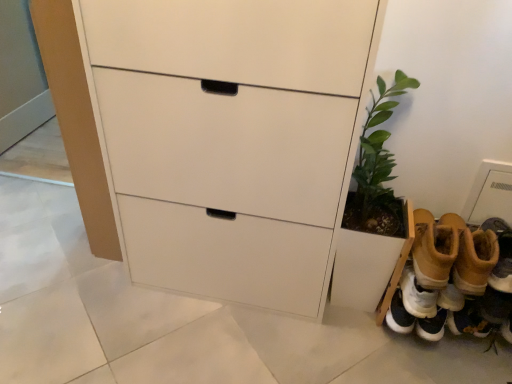
Image resolution: width=512 pixels, height=384 pixels. What do you see at coordinates (452, 282) in the screenshot?
I see `tan suede boots at lower right, positioned as the first footwear in right-to-left order` at bounding box center [452, 282].

Locate an element on the screen. Image resolution: width=512 pixels, height=384 pixels. white matte chest of drawers at center is located at coordinates (229, 138).

What do you see at coordinates (372, 213) in the screenshot? I see `green leafy plant at lower right` at bounding box center [372, 213].

Identify the location of tan suede boots at lower right, positioned as the first footwear in right-to-left order. The image size is (512, 384). (452, 282).

Is tan suede boots at lower right, positioned as the first footwear in right-to-left order, to the left of green leafy plant at lower right from the viewer's perspective?

No, tan suede boots at lower right, positioned as the first footwear in right-to-left order, is not to the left of green leafy plant at lower right.

Considering the sizes of objects tan suede boots at lower right, placed as the second footwear when sorted from left to right, and green leafy plant at lower right in the image provided, who is taller, tan suede boots at lower right, placed as the second footwear when sorted from left to right, or green leafy plant at lower right?

Standing taller between the two is green leafy plant at lower right.

How different are the orientations of tan suede boots at lower right, positioned as the first footwear in right-to-left order, and green leafy plant at lower right in degrees?

2.03 degrees separate the facing orientations of tan suede boots at lower right, positioned as the first footwear in right-to-left order, and green leafy plant at lower right.

Is tan suede boots at lower right, placed as the second footwear when sorted from left to right, directly adjacent to green leafy plant at lower right?

No, tan suede boots at lower right, placed as the second footwear when sorted from left to right, is not making contact with green leafy plant at lower right.

Between green leafy plant at lower right and white matte chest of drawers at center, which one is positioned in front?

white matte chest of drawers at center.

From a real-world perspective, is green leafy plant at lower right on white matte chest of drawers at center?

Incorrect, from a real-world perspective, green leafy plant at lower right is lower than white matte chest of drawers at center.

Is green leafy plant at lower right to the left or to the right of white matte chest of drawers at center in the image?

green leafy plant at lower right is positioned on white matte chest of drawers at center's right side.

From the image's perspective, between green leafy plant at lower right and white matte chest of drawers at center, which one is located above?

white matte chest of drawers at center.

Is tan suede boots at lower right, which appears as the 2th footwear when viewed from the right, smaller than green leafy plant at lower right?

Correct, tan suede boots at lower right, which appears as the 2th footwear when viewed from the right, occupies less space than green leafy plant at lower right.

Considering the positions of point (423, 281) and point (362, 131), is point (423, 281) closer or farther from the camera than point (362, 131)?

Clearly, point (423, 281) is more distant from the camera than point (362, 131).

Which object is positioned more to the right, tan suede boots at lower right, which appears as the first footwear when viewed from the left, or green leafy plant at lower right?

From the viewer's perspective, tan suede boots at lower right, which appears as the first footwear when viewed from the left, appears more on the right side.

Does white matte chest of drawers at center appear on the right side of green leafy plant at lower right?

No, white matte chest of drawers at center is not to the right of green leafy plant at lower right.

In terms of width, does white matte chest of drawers at center look wider or thinner when compared to green leafy plant at lower right?

Considering their sizes, white matte chest of drawers at center looks broader than green leafy plant at lower right.

Can you tell me how much white matte chest of drawers at center and green leafy plant at lower right differ in facing direction?

They differ by 1.4 degrees in their facing directions.

How distant is white matte chest of drawers at center from green leafy plant at lower right?

white matte chest of drawers at center and green leafy plant at lower right are 15.06 inches apart from each other.

Which object is positioned more to the left, tan suede boots at lower right, which appears as the 2th footwear when viewed from the right, or tan suede boots at lower right, placed as the second footwear when sorted from left to right?

tan suede boots at lower right, which appears as the 2th footwear when viewed from the right.

Measure the distance from tan suede boots at lower right, which appears as the 2th footwear when viewed from the right, to tan suede boots at lower right, positioned as the first footwear in right-to-left order.

The distance of tan suede boots at lower right, which appears as the 2th footwear when viewed from the right, from tan suede boots at lower right, positioned as the first footwear in right-to-left order, is 9.39 centimeters.

Which object is thinner, tan suede boots at lower right, which appears as the first footwear when viewed from the left, or tan suede boots at lower right, placed as the second footwear when sorted from left to right?

Thinner between the two is tan suede boots at lower right, placed as the second footwear when sorted from left to right.

From a real-world perspective, which footwear is the 2nd one underneath the white matte chest of drawers at center? Please provide its 2D coordinates.

[(452, 282)]

Considering the sizes of objects white matte chest of drawers at center and tan suede boots at lower right, positioned as the first footwear in right-to-left order, in the image provided, who is bigger, white matte chest of drawers at center or tan suede boots at lower right, positioned as the first footwear in right-to-left order,?

white matte chest of drawers at center is bigger.

Considering the positions of points (255, 8) and (451, 241), is point (255, 8) closer to camera compared to point (451, 241)?

Yes, point (255, 8) is closer to viewer.

Considering the sizes of objects white matte chest of drawers at center and tan suede boots at lower right, positioned as the first footwear in right-to-left order, in the image provided, who is shorter, white matte chest of drawers at center or tan suede boots at lower right, positioned as the first footwear in right-to-left order,?

tan suede boots at lower right, positioned as the first footwear in right-to-left order, is shorter.

Is tan suede boots at lower right, positioned as the first footwear in right-to-left order, bigger than white matte chest of drawers at center?

Incorrect, tan suede boots at lower right, positioned as the first footwear in right-to-left order, is not larger than white matte chest of drawers at center.

Is point (454, 271) positioned before point (183, 35)?

No, it is not.

Is tan suede boots at lower right, placed as the second footwear when sorted from left to right, thinner than white matte chest of drawers at center?

Indeed, tan suede boots at lower right, placed as the second footwear when sorted from left to right, has a lesser width compared to white matte chest of drawers at center.

Is tan suede boots at lower right, placed as the second footwear when sorted from left to right, surrounding white matte chest of drawers at center?

Actually, white matte chest of drawers at center is outside tan suede boots at lower right, placed as the second footwear when sorted from left to right.

Locate an element on the screen. The height and width of the screenshot is (384, 512). the 2nd footwear behind the green leafy plant at lower right, starting your count from the anchor is located at coordinates (452, 282).

Identify the location of the chest of drawers above the green leafy plant at lower right (from the image's perspective). (229, 138).

Based on their spatial positions, is tan suede boots at lower right, which appears as the 2th footwear when viewed from the right, or green leafy plant at lower right closer to white matte chest of drawers at center?

green leafy plant at lower right is closer to white matte chest of drawers at center.

From the picture: Which object lies further to the anchor point tan suede boots at lower right, which appears as the 2th footwear when viewed from the right, green leafy plant at lower right or tan suede boots at lower right, placed as the second footwear when sorted from left to right?

green leafy plant at lower right is further to tan suede boots at lower right, which appears as the 2th footwear when viewed from the right.

Which object lies nearer to the anchor point green leafy plant at lower right, tan suede boots at lower right, which appears as the 2th footwear when viewed from the right, or tan suede boots at lower right, placed as the second footwear when sorted from left to right?

tan suede boots at lower right, which appears as the 2th footwear when viewed from the right.

From the image, which object appears to be nearer to tan suede boots at lower right, positioned as the first footwear in right-to-left order, green leafy plant at lower right or white matte chest of drawers at center?

green leafy plant at lower right is closer to tan suede boots at lower right, positioned as the first footwear in right-to-left order.

Based on the photo, looking at the image, which one is located further to tan suede boots at lower right, placed as the second footwear when sorted from left to right, tan suede boots at lower right, which appears as the 2th footwear when viewed from the right, or white matte chest of drawers at center?

The object further to tan suede boots at lower right, placed as the second footwear when sorted from left to right, is white matte chest of drawers at center.

Which object lies nearer to the anchor point green leafy plant at lower right, tan suede boots at lower right, placed as the second footwear when sorted from left to right, or white matte chest of drawers at center?

tan suede boots at lower right, placed as the second footwear when sorted from left to right, lies closer to green leafy plant at lower right than the other object.

When comparing their distances from tan suede boots at lower right, which appears as the first footwear when viewed from the left, does white matte chest of drawers at center or green leafy plant at lower right seem further?

white matte chest of drawers at center is positioned further to the anchor tan suede boots at lower right, which appears as the first footwear when viewed from the left.

Which object lies nearer to the anchor point tan suede boots at lower right, placed as the second footwear when sorted from left to right, white matte chest of drawers at center or tan suede boots at lower right, which appears as the first footwear when viewed from the left?

tan suede boots at lower right, which appears as the first footwear when viewed from the left.

The image size is (512, 384). Identify the location of footwear between green leafy plant at lower right and tan suede boots at lower right, placed as the second footwear when sorted from left to right. (434, 248).

The height and width of the screenshot is (384, 512). What are the coordinates of `footwear located between white matte chest of drawers at center and tan suede boots at lower right, positioned as the first footwear in right-to-left order, in the left-right direction` in the screenshot? It's located at (434, 248).

Image resolution: width=512 pixels, height=384 pixels. In order to click on houseplant between white matte chest of drawers at center and tan suede boots at lower right, which appears as the first footwear when viewed from the left, in the horizontal direction in this screenshot , I will do `click(372, 213)`.

You are a GUI agent. You are given a task and a screenshot of the screen. Output one action in this format:
    pyautogui.click(x=<x>, y=<y>)
    Task: Click on the houseplant situated between white matte chest of drawers at center and tan suede boots at lower right, placed as the second footwear when sorted from left to right, from left to right
    
    Given the screenshot: What is the action you would take?
    point(372,213)